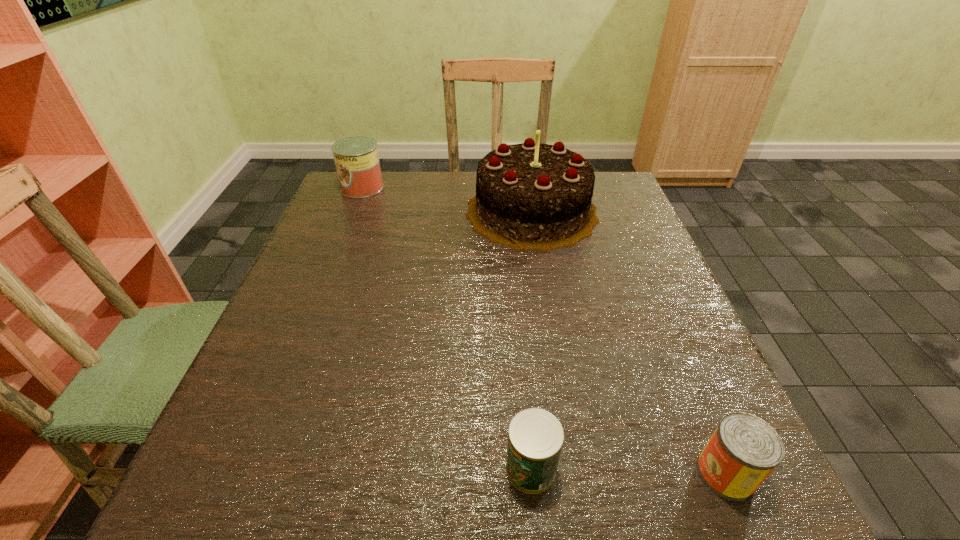
At what (x,y) coordinates should I click in order to perform the action: click on birthday cake. Please return your answer as a coordinate pair (x, y). This screenshot has height=540, width=960. Looking at the image, I should click on (529, 196).

The width and height of the screenshot is (960, 540). I want to click on the leftmost can, so click(x=356, y=158).

Locate an element on the screen. Image resolution: width=960 pixels, height=540 pixels. the second tallest object is located at coordinates (356, 158).

Identify the location of the second can from right to left. The image size is (960, 540). (535, 438).

Where is `the rightmost object`? The width and height of the screenshot is (960, 540). the rightmost object is located at coordinates (744, 449).

Locate an element on the screen. This screenshot has width=960, height=540. vacant space located 0.170m on the left of the tallest object is located at coordinates (400, 212).

You are a GUI agent. You are given a task and a screenshot of the screen. Output one action in this format:
    pyautogui.click(x=<x>, y=<y>)
    Task: Click on the free space located 0.340m on the right of the leftmost object
    Image resolution: width=960 pixels, height=540 pixels.
    Given the screenshot: What is the action you would take?
    pyautogui.click(x=504, y=188)

At what (x,y) coordinates should I click in order to perform the action: click on free region located on the right of the second can from left to right. Please return your answer as a coordinate pair (x, y). Looking at the image, I should click on (645, 469).

At what (x,y) coordinates should I click in order to perform the action: click on free location located on the left of the rightmost object. Please return your answer as a coordinate pair (x, y). This screenshot has width=960, height=540. Looking at the image, I should click on (538, 474).

Identify the location of birthday cake present at the far edge. (529, 196).